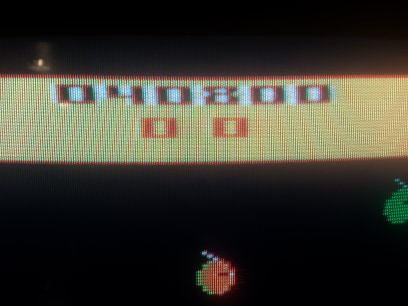
What are the coordinates of `knob` in the screenshot? It's located at (43, 49).